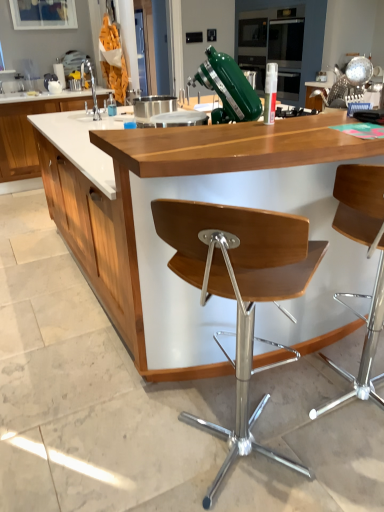
Question: From the image's perspective, is brushed metal sink at left located beneath white wood cabinet at left?

Choices:
 (A) yes
 (B) no

Answer: (A)

Question: Is brushed metal sink at left completely or partially outside of white wood cabinet at left?

Choices:
 (A) yes
 (B) no

Answer: (A)

Question: Considering the relative positions of brushed metal sink at left and white wood cabinet at left in the image provided, is brushed metal sink at left to the left of white wood cabinet at left from the viewer's perspective?

Choices:
 (A) no
 (B) yes

Answer: (A)

Question: From a real-world perspective, does brushed metal sink at left sit lower than white wood cabinet at left?

Choices:
 (A) no
 (B) yes

Answer: (A)

Question: Does brushed metal sink at left come behind white wood cabinet at left?

Choices:
 (A) no
 (B) yes

Answer: (A)

Question: Considering the positions of point (336, 212) and point (294, 309), is point (336, 212) closer or farther from the camera than point (294, 309)?

Choices:
 (A) closer
 (B) farther

Answer: (A)

Question: From a real-world perspective, is wooden seat at center, acting as the 2th chair starting from the left, physically located above or below wooden counter at center, the second countertop when ordered from top to bottom?

Choices:
 (A) above
 (B) below

Answer: (B)

Question: Considering the positions of wooden seat at center, the 1th chair viewed from the right, and wooden counter at center, which is the 2th countertop from left to right, in the image, is wooden seat at center, the 1th chair viewed from the right, wider or thinner than wooden counter at center, which is the 2th countertop from left to right,?

Choices:
 (A) thin
 (B) wide

Answer: (A)

Question: Visually, is wooden seat at center, acting as the 2th chair starting from the left, positioned to the left or to the right of wooden counter at center, which is the 1th countertop in right-to-left order?

Choices:
 (A) left
 (B) right

Answer: (B)

Question: Is white wood cabinet at left bigger or smaller than wooden counter at center, which is the 1th countertop in right-to-left order?

Choices:
 (A) big
 (B) small

Answer: (B)

Question: From a real-world perspective, is white wood cabinet at left positioned above or below wooden counter at center, acting as the first countertop starting from the bottom?

Choices:
 (A) above
 (B) below

Answer: (B)

Question: Is point (16, 163) positioned closer to the camera than point (195, 339)?

Choices:
 (A) closer
 (B) farther

Answer: (B)

Question: In terms of height, does white wood cabinet at left look taller or shorter compared to wooden counter at center, the second countertop when ordered from top to bottom?

Choices:
 (A) short
 (B) tall

Answer: (A)

Question: Relative to white marble countertop at upper left, positioned as the 1th countertop in left-to-right order, is white wood cabinet at left in front or behind?

Choices:
 (A) front
 (B) behind

Answer: (A)

Question: From a real-world perspective, is white wood cabinet at left physically located above or below white marble countertop at upper left, marked as the 2th countertop in a front-to-back arrangement?

Choices:
 (A) below
 (B) above

Answer: (A)